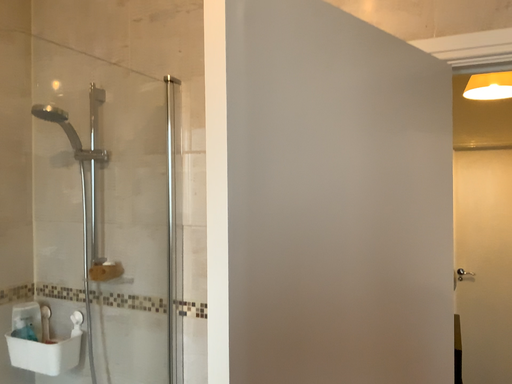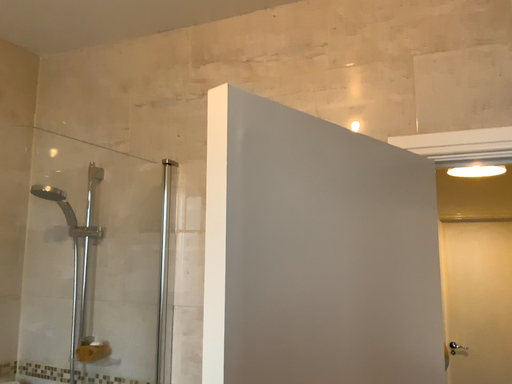
Question: Which way did the camera rotate in the video?

Choices:
 (A) rotated upward
 (B) rotated downward

Answer: (A)